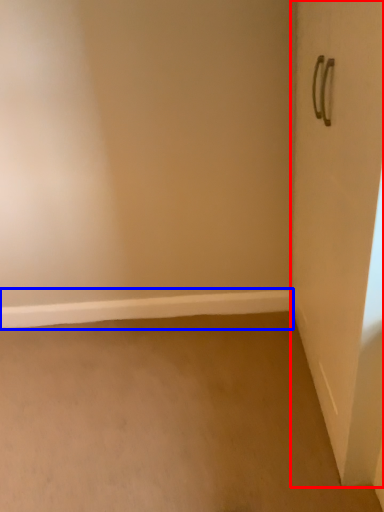
Question: Which of the following is the farthest to the observer, door (highlighted by a red box) or window sill (highlighted by a blue box)?

Choices:
 (A) door
 (B) window sill

Answer: (B)